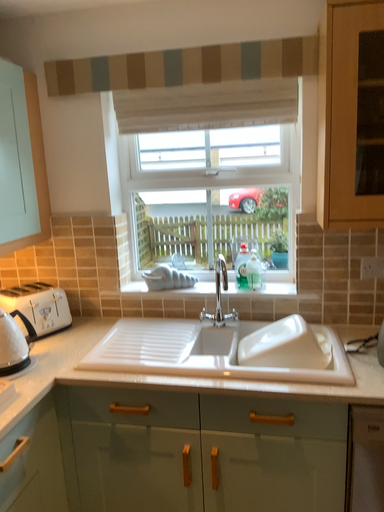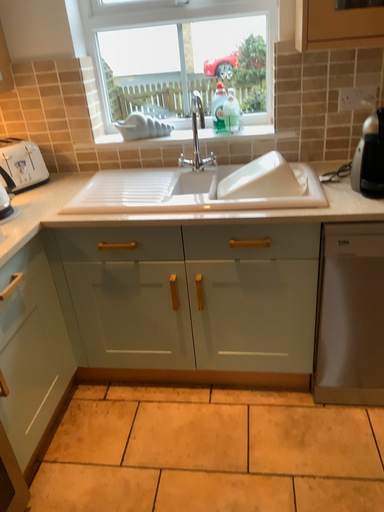
Question: How did the camera likely rotate when shooting the video?

Choices:
 (A) rotated upward
 (B) rotated downward

Answer: (B)